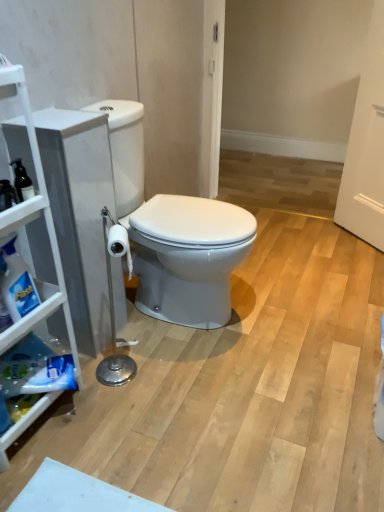
Question: Does white matte cabinet at left have a larger size compared to white glossy toilet at center?

Choices:
 (A) no
 (B) yes

Answer: (A)

Question: From a real-world perspective, is white matte cabinet at left located beneath white glossy toilet at center?

Choices:
 (A) yes
 (B) no

Answer: (B)

Question: Does white matte cabinet at left have a smaller size compared to white glossy toilet at center?

Choices:
 (A) no
 (B) yes

Answer: (B)

Question: Does white matte cabinet at left appear on the right side of white glossy toilet at center?

Choices:
 (A) no
 (B) yes

Answer: (A)

Question: Would you say white glossy toilet at center is part of white matte cabinet at left's contents?

Choices:
 (A) yes
 (B) no

Answer: (B)

Question: From the image's perspective, is translucent plastic spray bottle at left located above or below white glossy toilet at center?

Choices:
 (A) below
 (B) above

Answer: (A)

Question: Considering the positions of translucent plastic spray bottle at left and white glossy toilet at center in the image, is translucent plastic spray bottle at left taller or shorter than white glossy toilet at center?

Choices:
 (A) short
 (B) tall

Answer: (A)

Question: Considering the positions of translucent plastic spray bottle at left and white glossy toilet at center in the image, is translucent plastic spray bottle at left bigger or smaller than white glossy toilet at center?

Choices:
 (A) big
 (B) small

Answer: (B)

Question: Looking at their shapes, would you say translucent plastic spray bottle at left is wider or thinner than white glossy toilet at center?

Choices:
 (A) thin
 (B) wide

Answer: (A)

Question: From the image's perspective, is white glossy toilet at center above or below translucent plastic spray bottle at left?

Choices:
 (A) above
 (B) below

Answer: (A)

Question: Is white glossy toilet at center situated inside translucent plastic spray bottle at left or outside?

Choices:
 (A) outside
 (B) inside

Answer: (A)

Question: From a real-world perspective, is white glossy toilet at center physically located above or below translucent plastic spray bottle at left?

Choices:
 (A) above
 (B) below

Answer: (B)

Question: Considering the positions of point pyautogui.click(x=152, y=272) and point pyautogui.click(x=16, y=275), is point pyautogui.click(x=152, y=272) closer or farther from the camera than point pyautogui.click(x=16, y=275)?

Choices:
 (A) farther
 (B) closer

Answer: (A)

Question: Considering their positions, is white matte cabinet at left located in front of or behind white glossy toilet at center?

Choices:
 (A) front
 (B) behind

Answer: (A)

Question: Looking at their shapes, would you say white matte cabinet at left is wider or thinner than white glossy toilet at center?

Choices:
 (A) thin
 (B) wide

Answer: (A)